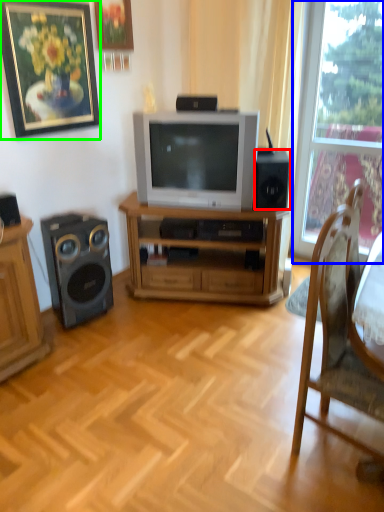
Question: Considering the real-world distances, which object is closest to speaker (highlighted by a red box)? window (highlighted by a blue box) or picture frame (highlighted by a green box).

Choices:
 (A) window
 (B) picture frame

Answer: (A)